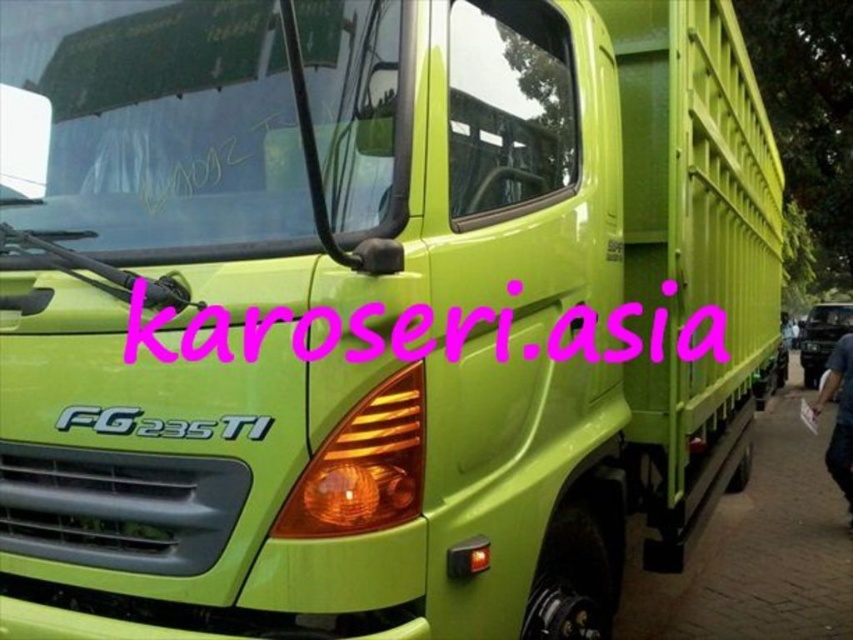
You are standing at the point closest to the lime green truck labeled FG 235 TI. There are two points marked in the image, one at coordinates point (578, 304) and another at point (804, 342). Which of these points is closer to you?

Point (578, 304) is in front of point (804, 342), so it is closer to you.

You are standing 2 meters away from the lime green truck FG 235 TI. You want to read the pink text at center on the truck. Can you reach it without moving closer?

The pink text at center is 1.68 meters away from the camera. Since you are standing 2 meters away from the lime green truck FG 235 TI, you are farther than the distance required to read the text. Therefore, you need to move closer to read it clearly.

What are the coordinates of the pink text at center in the image?

The pink text at center is located at coordinates point (606,332).